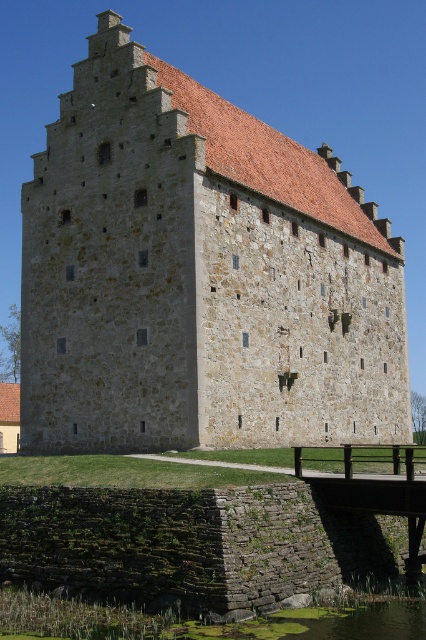
Is point (126, 176) positioned after point (368, 492)?

Yes, it is.

Which is below, stone brick castle at center or brown wooden bridge at lower center?

brown wooden bridge at lower center is below.

Which is behind, point (247, 240) or point (294, 472)?

Positioned behind is point (247, 240).

Where is `stone brick castle at center`? stone brick castle at center is located at coordinates (198, 275).

Can you confirm if stone brick castle at center is bigger than green mossy water at lower center?

Yes.

The width and height of the screenshot is (426, 640). Identify the location of stone brick castle at center. (198, 275).

This screenshot has height=640, width=426. In order to click on stone brick castle at center in this screenshot , I will do `click(198, 275)`.

Who is positioned more to the left, green mossy water at lower center or brown wooden bridge at lower center?

green mossy water at lower center

Is green mossy water at lower center wider than brown wooden bridge at lower center?

Yes, green mossy water at lower center is wider than brown wooden bridge at lower center.

Which is in front, point (354, 634) or point (409, 497)?

Point (354, 634) is more forward.

This screenshot has height=640, width=426. Identify the location of green mossy water at lower center. (203, 624).